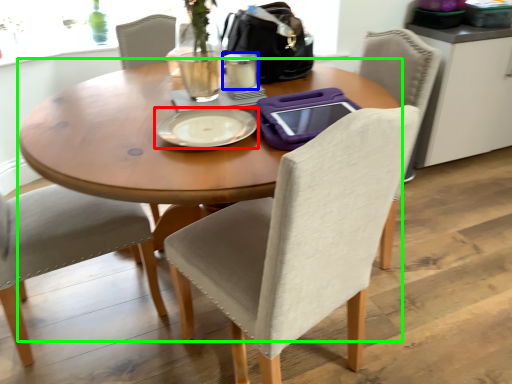
Question: Which object is positioned closest to plate (highlighted by a red box)? Select from coffee cup (highlighted by a blue box) and kitchen & dining room table (highlighted by a green box).

Choices:
 (A) coffee cup
 (B) kitchen & dining room table

Answer: (B)